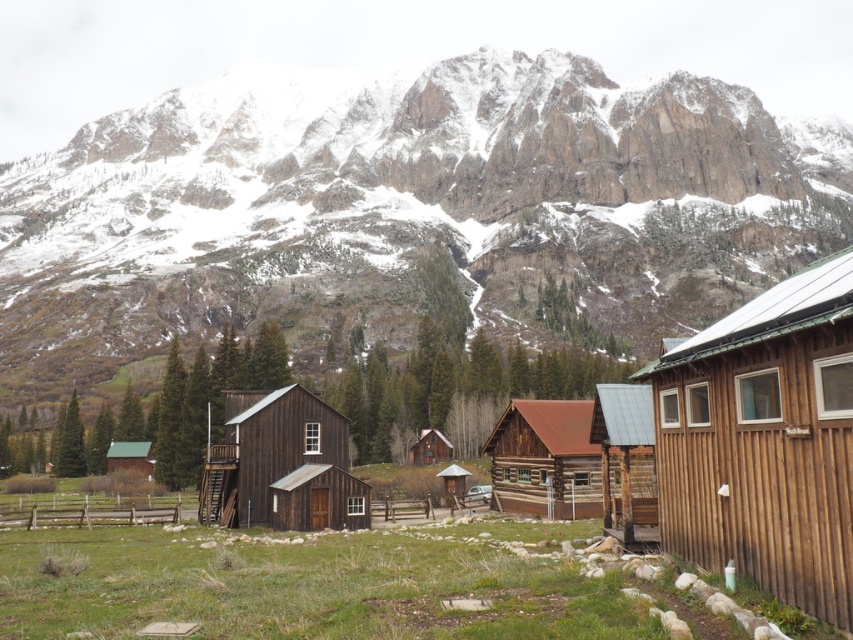
Between dark brown wooden cabin at center-left and rustic wood cabin at center, which one is positioned higher?

rustic wood cabin at center

Is dark brown wooden cabin at center-left bigger than rustic wood cabin at center?

Incorrect, dark brown wooden cabin at center-left is not larger than rustic wood cabin at center.

This screenshot has height=640, width=853. What are the coordinates of `dark brown wooden cabin at center-left` in the screenshot? It's located at (281, 465).

Can you confirm if snowy rock mountain at upper center is smaller than green shingled cabin at lower left?

No.

How distant is snowy rock mountain at upper center from green shingled cabin at lower left?

They are 353.87 feet apart.

This screenshot has width=853, height=640. Identify the location of snowy rock mountain at upper center. (407, 205).

Is snowy rock mountain at upper center closer to the viewer compared to rustic wood cabin at center?

No, it is not.

Consider the image. Which is more to the left, snowy rock mountain at upper center or rustic wood cabin at center?

snowy rock mountain at upper center

Who is more forward, (x=830, y=145) or (x=503, y=420)?

Point (x=503, y=420) is more forward.

At what (x,y) coordinates should I click in order to perform the action: click on snowy rock mountain at upper center. Please return your answer as a coordinate pair (x, y). The image size is (853, 640). Looking at the image, I should click on (407, 205).